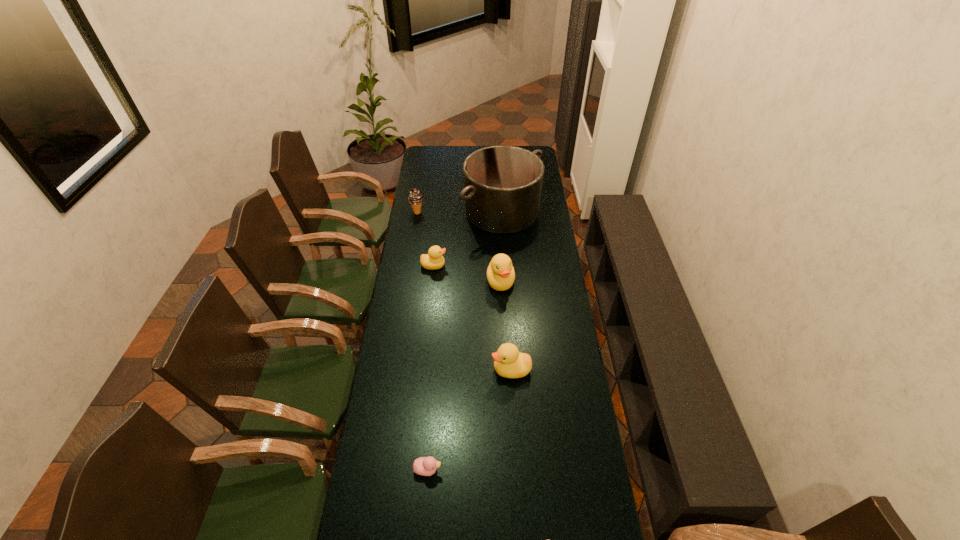
This screenshot has width=960, height=540. What are the coordinates of `the tallest object` in the screenshot? It's located at (502, 184).

You are a GUI agent. You are given a task and a screenshot of the screen. Output one action in this format:
    pyautogui.click(x=<x>, y=<y>)
    Task: Click on the biggest yellow duckling
    
    Given the screenshot: What is the action you would take?
    point(500,273)

The height and width of the screenshot is (540, 960). Identify the location of icecream. click(415, 198).

Where is `chocolate icecream`? The image size is (960, 540). chocolate icecream is located at coordinates (415, 198).

Identify the location of the nearest yellow duckling. The image size is (960, 540). (508, 362).

Identify the location of the third farthest duckling. This screenshot has width=960, height=540. (508, 362).

The image size is (960, 540). Find the location of `the smallest yellow duckling`. the smallest yellow duckling is located at coordinates (433, 260).

At what (x,y) coordinates should I click in order to perform the action: click on the fourth farthest duckling. Please return your answer as a coordinate pair (x, y). This screenshot has width=960, height=540. Looking at the image, I should click on (426, 466).

Find the location of a particular element. the sixth farthest object is located at coordinates (426, 466).

In order to click on vacant area situated on the back of the tallest object in this screenshot , I will do `click(499, 168)`.